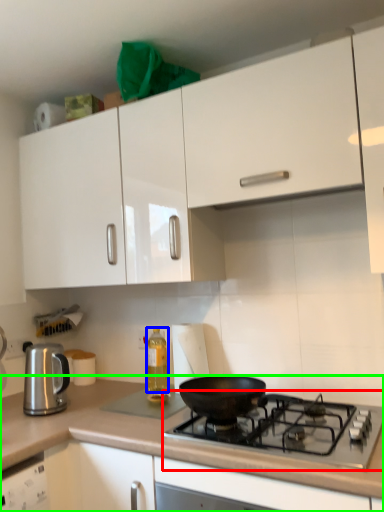
Question: Which is nearer to the gas stove (highlighted by a red box)? bottle (highlighted by a blue box) or countertop (highlighted by a green box).

Choices:
 (A) bottle
 (B) countertop

Answer: (B)